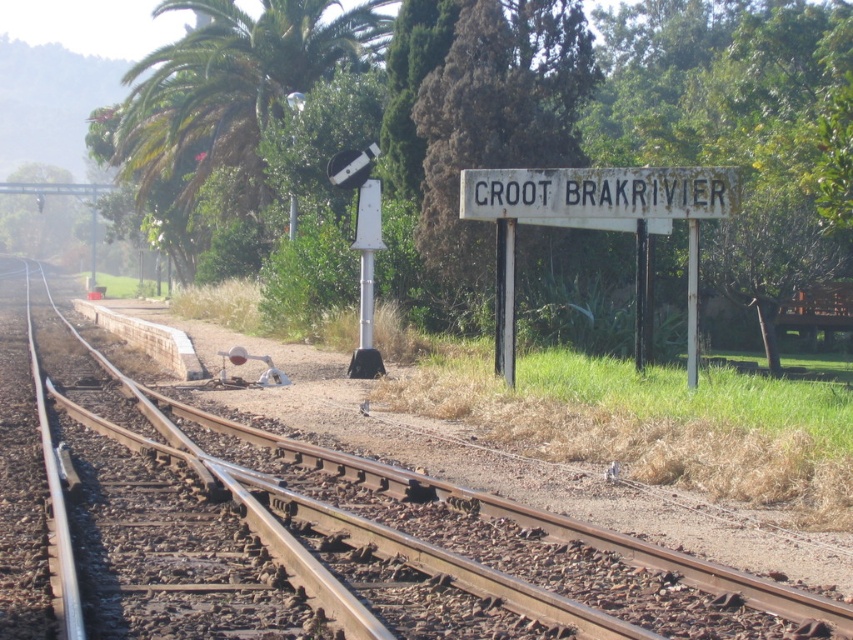
Which is more to the left, green leafy tree at upper right or green textured tree at center?

From the viewer's perspective, green textured tree at center appears more on the left side.

Does green leafy tree at upper right come in front of green textured tree at center?

Yes, green leafy tree at upper right is in front of green textured tree at center.

The width and height of the screenshot is (853, 640). I want to click on green leafy tree at upper right, so click(740, 124).

Where is `green leafy tree at upper right`? green leafy tree at upper right is located at coordinates (740, 124).

Is brown gravel train track at center shorter than green textured tree at center?

In fact, brown gravel train track at center may be taller than green textured tree at center.

Where is `brown gravel train track at center`? Image resolution: width=853 pixels, height=640 pixels. brown gravel train track at center is located at coordinates (410, 536).

Can you confirm if green leafy tree at upper right is shorter than white faded sign at center?

Incorrect, green leafy tree at upper right's height does not fall short of white faded sign at center's.

The width and height of the screenshot is (853, 640). Describe the element at coordinates (740, 124) in the screenshot. I see `green leafy tree at upper right` at that location.

Locate an element on the screen. The width and height of the screenshot is (853, 640). green leafy tree at upper right is located at coordinates (740, 124).